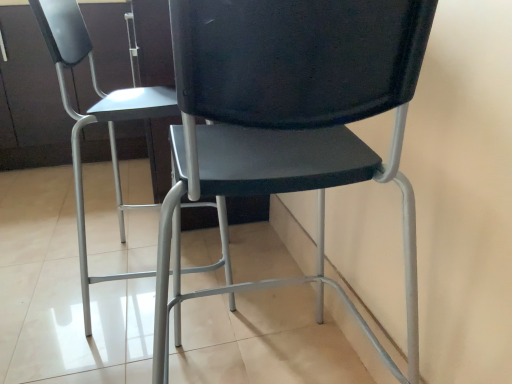
Question: Considering the relative sizes of matte black chair at center, the first chair viewed from the left, and matte black chair at center, the second chair positioned from the left, in the image provided, is matte black chair at center, the first chair viewed from the left, bigger than matte black chair at center, the second chair positioned from the left,?

Choices:
 (A) no
 (B) yes

Answer: (B)

Question: From a real-world perspective, is matte black chair at center, the first chair viewed from the left, over matte black chair at center, the 1th chair in the right-to-left sequence?

Choices:
 (A) yes
 (B) no

Answer: (A)

Question: Can we say matte black chair at center, the first chair viewed from the left, lies outside matte black chair at center, the 1th chair in the right-to-left sequence?

Choices:
 (A) no
 (B) yes

Answer: (B)

Question: Considering the relative positions of matte black chair at center, the second chair in the right-to-left sequence, and matte black chair at center, the second chair positioned from the left, in the image provided, is matte black chair at center, the second chair in the right-to-left sequence, to the left of matte black chair at center, the second chair positioned from the left, from the viewer's perspective?

Choices:
 (A) yes
 (B) no

Answer: (A)

Question: Is matte black chair at center, the second chair positioned from the left, located within matte black chair at center, the second chair in the right-to-left sequence?

Choices:
 (A) no
 (B) yes

Answer: (A)

Question: Does matte black chair at center, the second chair in the right-to-left sequence, have a greater width compared to matte black chair at center, the 1th chair in the right-to-left sequence?

Choices:
 (A) no
 (B) yes

Answer: (B)

Question: From the image's perspective, is matte black chair at center, the second chair positioned from the left, beneath matte black chair at center, the second chair in the right-to-left sequence?

Choices:
 (A) yes
 (B) no

Answer: (A)

Question: Does matte black chair at center, the 1th chair in the right-to-left sequence, lie behind matte black chair at center, the first chair viewed from the left?

Choices:
 (A) no
 (B) yes

Answer: (A)

Question: Can you confirm if matte black chair at center, the second chair positioned from the left, is bigger than matte black chair at center, the first chair viewed from the left?

Choices:
 (A) no
 (B) yes

Answer: (A)

Question: Is matte black chair at center, the 1th chair in the right-to-left sequence, facing away from matte black chair at center, the first chair viewed from the left?

Choices:
 (A) yes
 (B) no

Answer: (B)

Question: Can you confirm if matte black chair at center, the second chair positioned from the left, is positioned to the right of matte black chair at center, the first chair viewed from the left?

Choices:
 (A) yes
 (B) no

Answer: (A)

Question: Can we say matte black chair at center, the second chair positioned from the left, lies outside matte black chair at center, the second chair in the right-to-left sequence?

Choices:
 (A) yes
 (B) no

Answer: (A)

Question: Considering the positions of point (80, 16) and point (172, 6), is point (80, 16) closer or farther from the camera than point (172, 6)?

Choices:
 (A) closer
 (B) farther

Answer: (B)